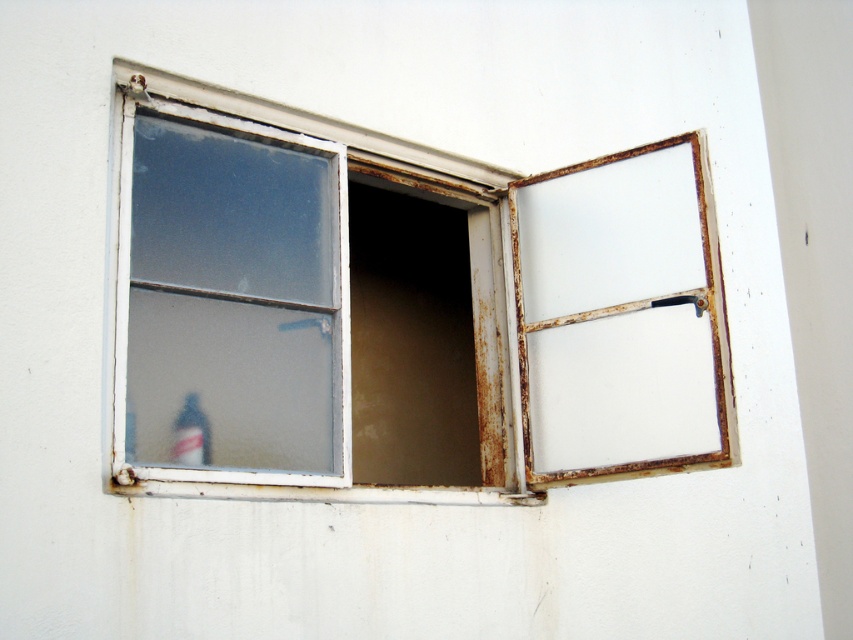
Is rusty metal window at center behind translucent glass bottle at lower left?

No, rusty metal window at center is closer to the viewer.

Does rusty metal window at center have a greater width compared to translucent glass bottle at lower left?

Correct, the width of rusty metal window at center exceeds that of translucent glass bottle at lower left.

What do you see at coordinates (355, 292) in the screenshot? This screenshot has width=853, height=640. I see `rusty metal window at center` at bounding box center [355, 292].

Locate an element on the screen. rusty metal window at center is located at coordinates (355, 292).